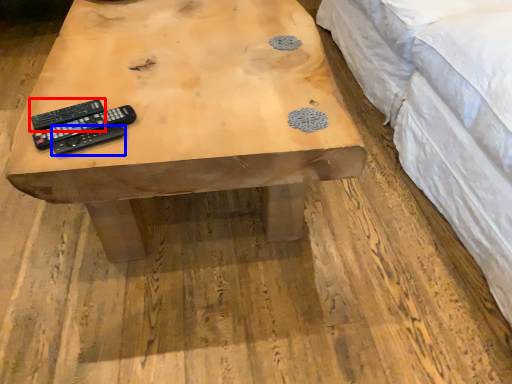
Question: Among these objects, which one is farthest to the camera, remote control (highlighted by a red box) or remote control (highlighted by a blue box)?

Choices:
 (A) remote control
 (B) remote control

Answer: (A)